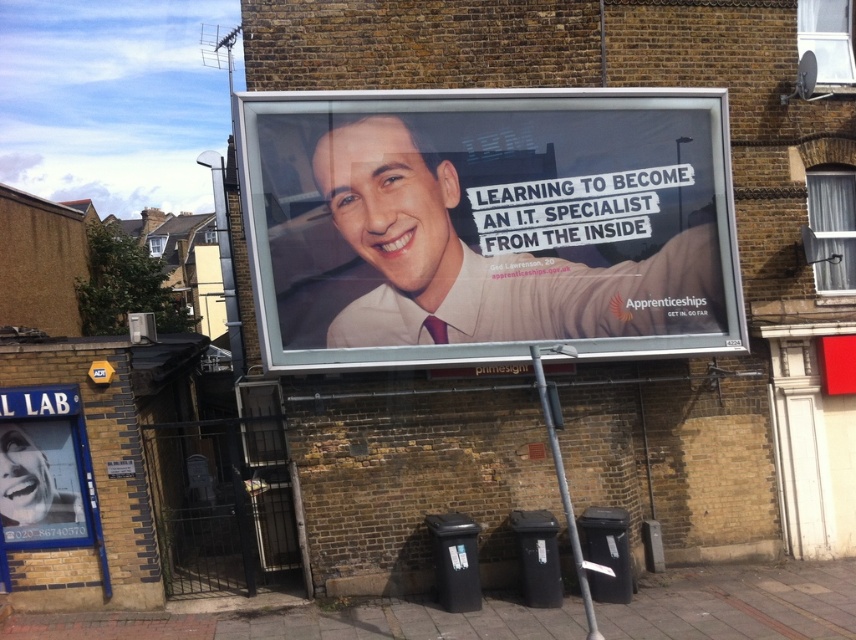
You are a pedestrian walking on the sidewalk in front of the brick wall. You see the white glossy billboard at center and the white glossy poster at lower left. Which one is higher up on the wall?

The white glossy billboard at center is positioned over the white glossy poster at lower left, so it is higher up on the wall.

You are standing in front of a brick wall with a large billboard. The billboard has a man in a light shirt and red tie. There is a point marked at coordinates (x=486, y=225). What object is located at that point?

The point at coordinates (x=486, y=225) indicates the white glossy billboard at center.

You are standing in front of the billboard and want to touch both points on it. Which point, point [510,125] or point [9,513], will you reach first?

Point [510,125] is further to the camera than point [9,513], so you will reach point [9,513] first because it is closer to you.